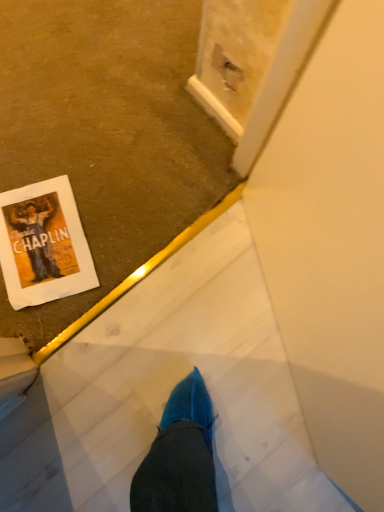
Question: Should I look upward or downward to see white paper at lower left?

Choices:
 (A) down
 (B) up

Answer: (B)